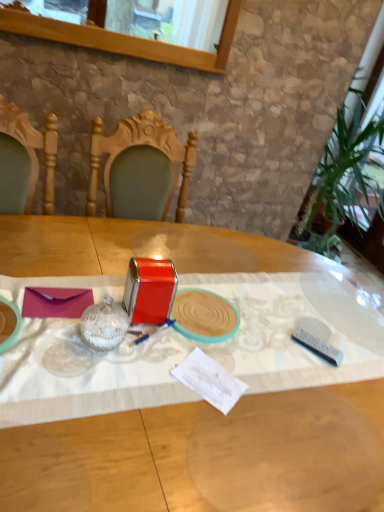
Image resolution: width=384 pixels, height=512 pixels. Find the location of `free spot to the right of metallic red tin at center, marked as the third tableware in a left-to-right arrangement`. free spot to the right of metallic red tin at center, marked as the third tableware in a left-to-right arrangement is located at coordinates (268, 343).